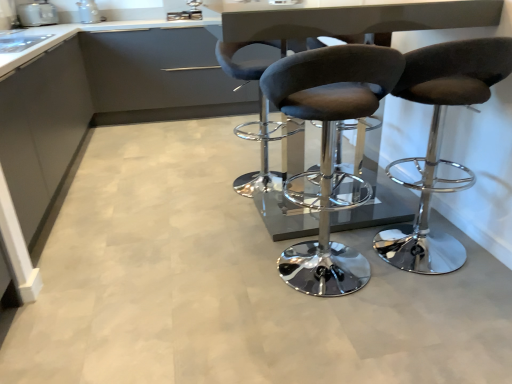
Question: Considering the positions of suede-like brown stool at center, the third chair from the left, and white glossy toaster at upper left, the second appliance in the left-to-right sequence, in the image, is suede-like brown stool at center, the third chair from the left, wider or thinner than white glossy toaster at upper left, the second appliance in the left-to-right sequence,?

Choices:
 (A) wide
 (B) thin

Answer: (A)

Question: From a real-world perspective, is suede-like brown stool at center, arranged as the first chair when viewed from the right, above or below white glossy toaster at upper left, the second appliance in the left-to-right sequence?

Choices:
 (A) below
 (B) above

Answer: (A)

Question: Estimate the real-world distances between objects in this image. Which object is closer to the velvet-like dark gray stool at center, the 2th chair positioned from the right?

Choices:
 (A) white glossy toaster at upper left, which is the first appliance from right to left
 (B) suede-like brown stool at center, the third chair from the left
 (C) dark gray fabric stool at center, which is the 3th chair from right to left
 (D) metallic silver toaster at upper left, the first appliance positioned from the left
 (E) matte gray cabinet at left

Answer: (B)

Question: Based on their relative distances, which object is farther from the white glossy toaster at upper left, the second appliance in the left-to-right sequence?

Choices:
 (A) metallic silver toaster at upper left, marked as the second appliance in a right-to-left arrangement
 (B) metallic gray table at center
 (C) suede-like brown stool at center, arranged as the first chair when viewed from the right
 (D) velvet-like dark gray stool at center, the 2th chair positioned from the right
 (E) dark gray fabric stool at center, which is the 3th chair from right to left

Answer: (C)